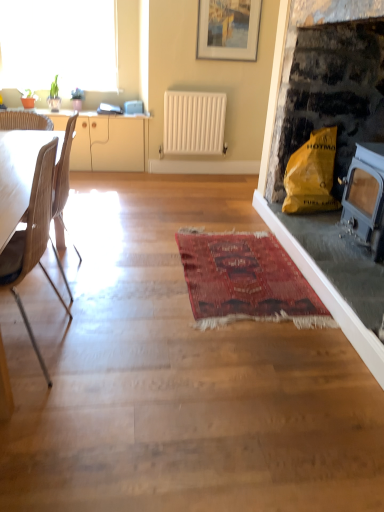
What are the coordinates of `vacant area that lies to the right of light brown wood chair at left, placed as the first chair when sorted from back to front` in the screenshot? It's located at (130, 282).